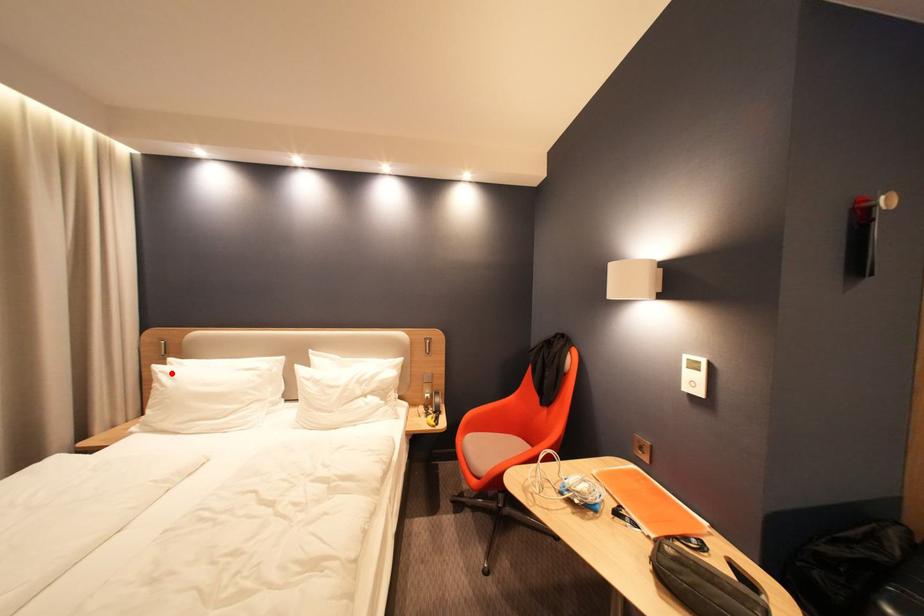
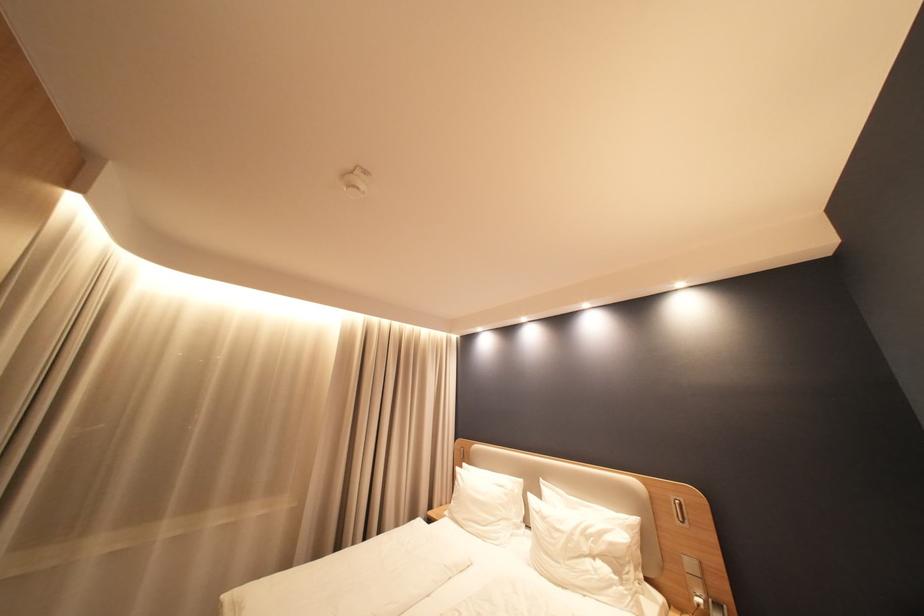
Question: I am providing you with two images of the same scene from different viewpoints. A red point is marked on the first image. Is the red point's position out of view in image 2?

Choices:
 (A) Yes
 (B) No

Answer: (B)